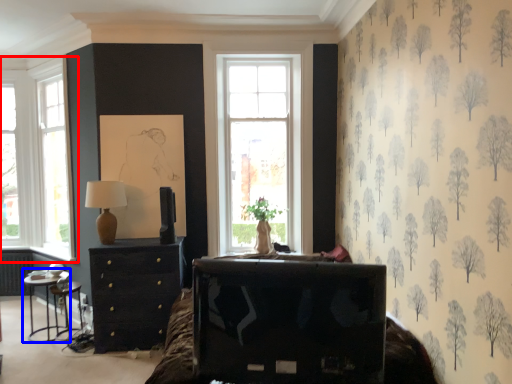
Question: Which point is further to the camera, window (highlighted by a red box) or table (highlighted by a blue box)?

Choices:
 (A) window
 (B) table

Answer: (A)